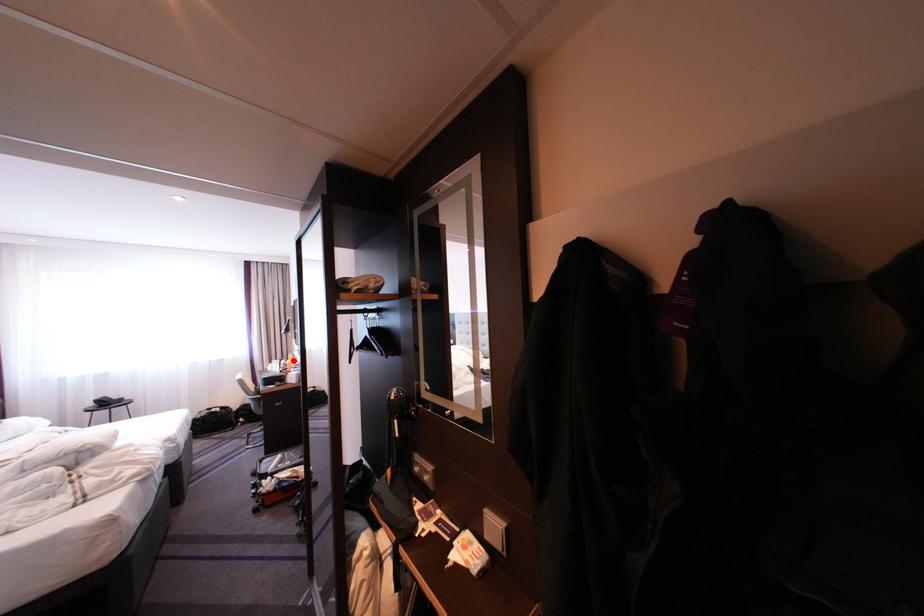
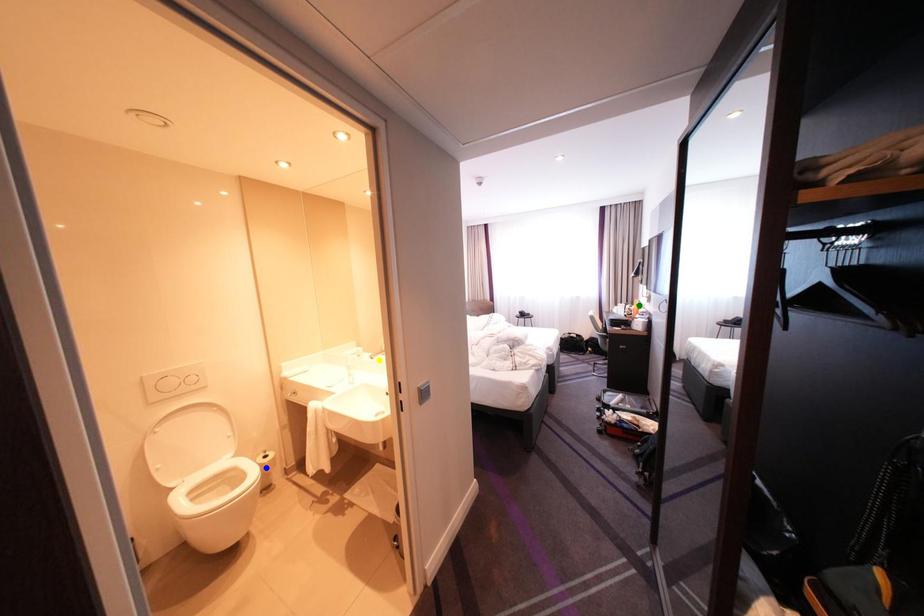
Question: I am providing you with two images of the same scene from different viewpoints. A red point is marked on the first image. You are given multiple points on the second image. Which spot in image 2 lines up with the point in image 1?

Choices:
 (A) green point
 (B) yellow point
 (C) blue point

Answer: (A)